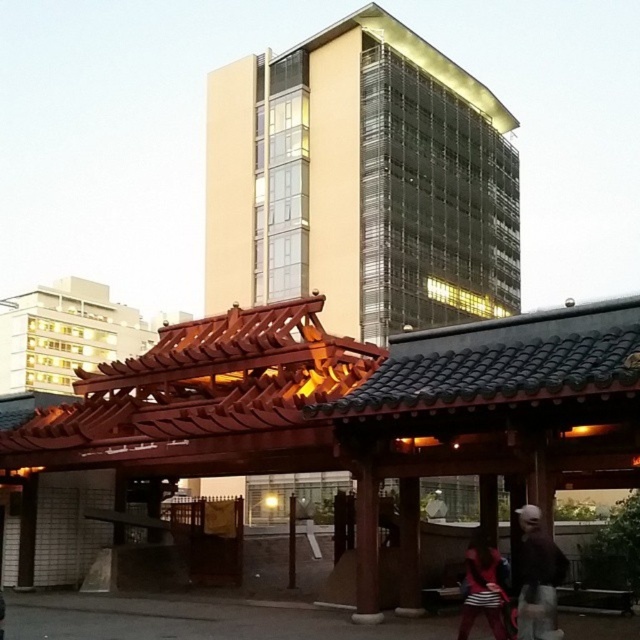
Question: Which object is positioned closest to the striped fabric bag at lower right?

Choices:
 (A) beige glass building at upper center
 (B) dark brown leather jacket at lower right

Answer: (B)

Question: Is beige glass building at upper center thinner than striped fabric bag at lower right?

Choices:
 (A) no
 (B) yes

Answer: (A)

Question: Considering the relative positions of dark brown leather jacket at lower right and striped fabric bag at lower right in the image provided, where is dark brown leather jacket at lower right located with respect to striped fabric bag at lower right?

Choices:
 (A) above
 (B) below

Answer: (A)

Question: Which point appears farthest from the camera in this image?

Choices:
 (A) (544, 547)
 (B) (486, 541)

Answer: (B)

Question: Can you confirm if beige glass building at upper center is positioned above striped fabric bag at lower right?

Choices:
 (A) yes
 (B) no

Answer: (A)

Question: Which point is farther to the camera?

Choices:
 (A) beige glass building at upper center
 (B) dark brown leather jacket at lower right

Answer: (A)